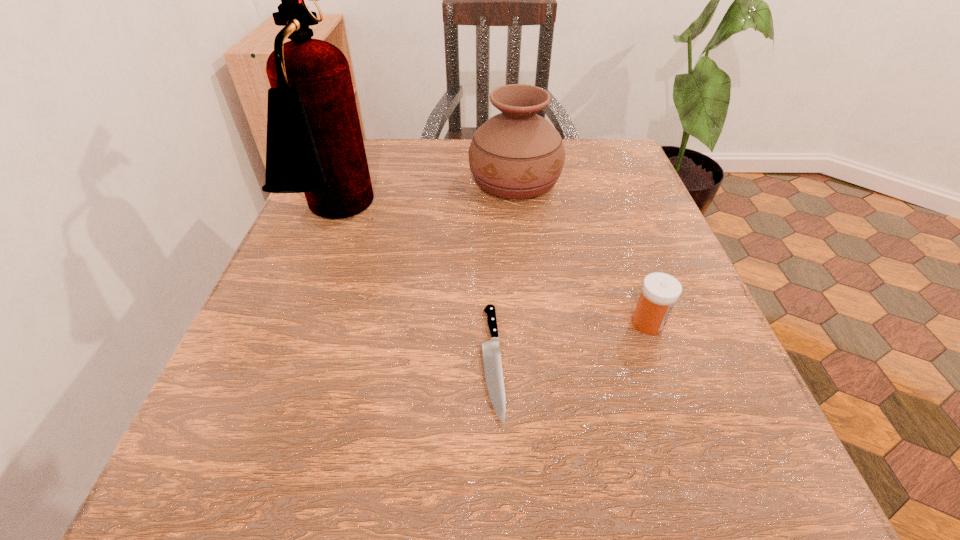
You are a GUI agent. You are given a task and a screenshot of the screen. Output one action in this format:
    pyautogui.click(x=<x>, y=<y>)
    Task: Click on the free space between the second shortest object and the shortest object
    The width and height of the screenshot is (960, 540).
    Given the screenshot: What is the action you would take?
    pyautogui.click(x=570, y=342)

Identify which object is located as the third nearest to the urn. Please provide its 2D coordinates. Your answer should be formatted as a tuple, i.e. [(x, y)], where the tuple contains the x and y coordinates of a point satisfying the conditions above.

[(660, 291)]

Where is `the second closest object to the leftmost object`? The height and width of the screenshot is (540, 960). the second closest object to the leftmost object is located at coordinates (492, 363).

Locate an element on the screen. Image resolution: width=960 pixels, height=540 pixels. free space that satisfies the following two spatial constraints: 1. at the nozzle of the tallest object; 2. on the left side of the medicine is located at coordinates (294, 323).

This screenshot has height=540, width=960. What are the coordinates of `blank space that satisfies the following two spatial constraints: 1. on the front side of the medicine; 2. on the right side of the urn` in the screenshot? It's located at (530, 323).

The image size is (960, 540). Identify the location of free space that satisfies the following two spatial constraints: 1. on the back side of the third tallest object; 2. at the nozzle of the tallest object. (610, 215).

At what (x,y) coordinates should I click in order to perform the action: click on free point that satisfies the following two spatial constraints: 1. on the back side of the rightmost object; 2. at the nozzle of the fire extinguisher. Please return your answer as a coordinate pair (x, y). Looking at the image, I should click on (610, 215).

Locate an element on the screen. Image resolution: width=960 pixels, height=540 pixels. vacant space that satisfies the following two spatial constraints: 1. at the nozzle of the second shortest object; 2. on the right side of the tallest object is located at coordinates (294, 323).

Find the location of a particular element. The width and height of the screenshot is (960, 540). vacant region that satisfies the following two spatial constraints: 1. on the back side of the urn; 2. on the left side of the steak knife is located at coordinates (489, 180).

The width and height of the screenshot is (960, 540). Find the location of `vacant region that satisfies the following two spatial constraints: 1. at the nozzle of the steak knife; 2. on the right side of the tallest object`. vacant region that satisfies the following two spatial constraints: 1. at the nozzle of the steak knife; 2. on the right side of the tallest object is located at coordinates (279, 361).